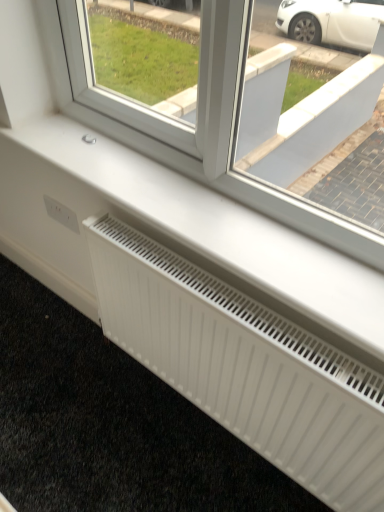
Where is `white matte radiator at lower center`? This screenshot has width=384, height=512. white matte radiator at lower center is located at coordinates (244, 365).

The image size is (384, 512). Describe the element at coordinates (244, 365) in the screenshot. I see `white matte radiator at lower center` at that location.

What is the approximate height of white matte radiator at lower center?

white matte radiator at lower center is 20.56 inches tall.

At what (x,y) coordinates should I click in order to perform the action: click on white matte radiator at lower center. Please return your answer as a coordinate pair (x, y). This screenshot has height=512, width=384. Looking at the image, I should click on (244, 365).